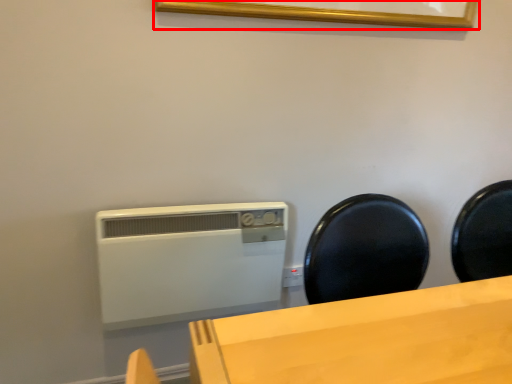
Question: From the image's perspective, what is the correct spatial relationship of picture frame (annotated by the red box) in relation to home appliance?

Choices:
 (A) above
 (B) below

Answer: (A)